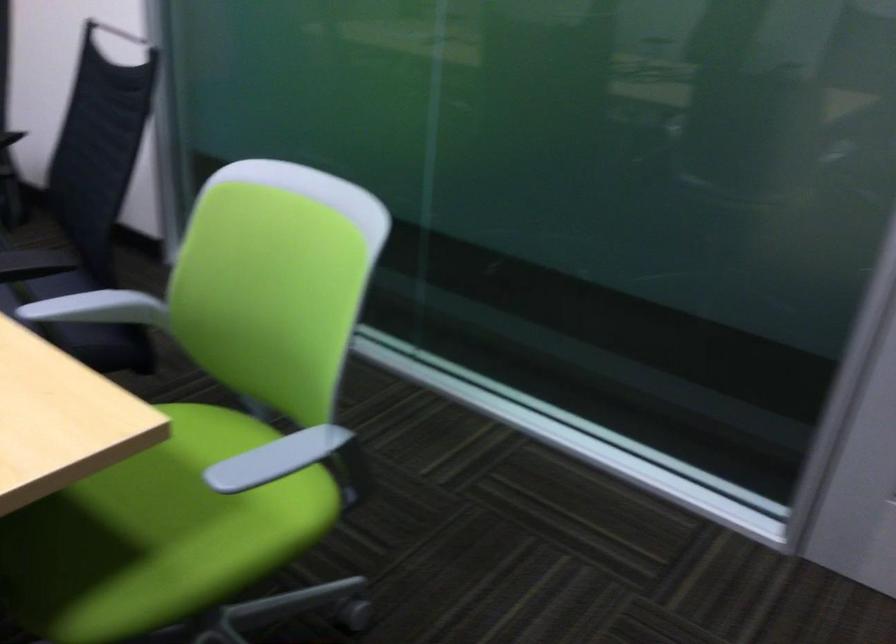
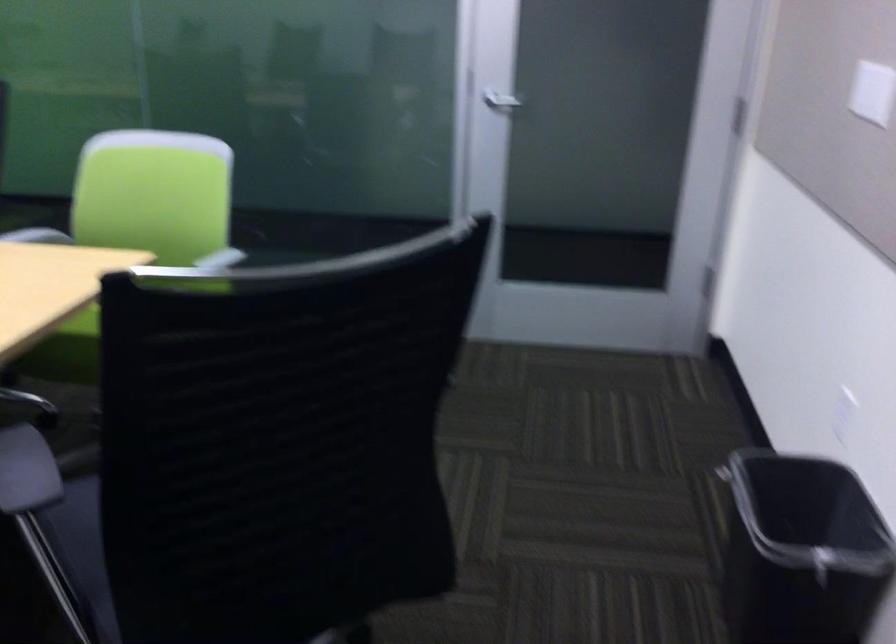
Question: I am providing you with two images of the same scene from different viewpoints. Please identify which objects are invisible in image2.

Choices:
 (A) white light switch
 (B) green chair sitting surface
 (C) silver water kettle
 (D) silver door handle

Answer: (B)